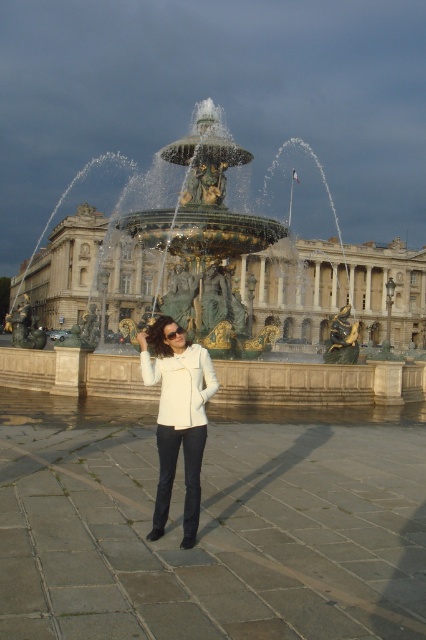
Question: Which point appears farthest from the camera in this image?

Choices:
 (A) (140, 332)
 (B) (94, 276)
 (C) (112, 259)

Answer: (C)

Question: Does bronze/golden water at center have a lesser width compared to white matte jacket at center?

Choices:
 (A) no
 (B) yes

Answer: (A)

Question: Among these objects, which one is farthest from the camera?

Choices:
 (A) bronze/golden water at center
 (B) gold/gilded stone fountain at center
 (C) white matte jacket at center

Answer: (B)

Question: Observing the image, what is the correct spatial positioning of bronze/golden water at center in reference to white matte jacket at center?

Choices:
 (A) left
 (B) right

Answer: (A)

Question: Is bronze/golden water at center above gold/gilded stone fountain at center?

Choices:
 (A) no
 (B) yes

Answer: (B)

Question: Among these points, which one is farthest from the camera?

Choices:
 (A) (325, 241)
 (B) (146, 364)
 (C) (359, 304)

Answer: (A)